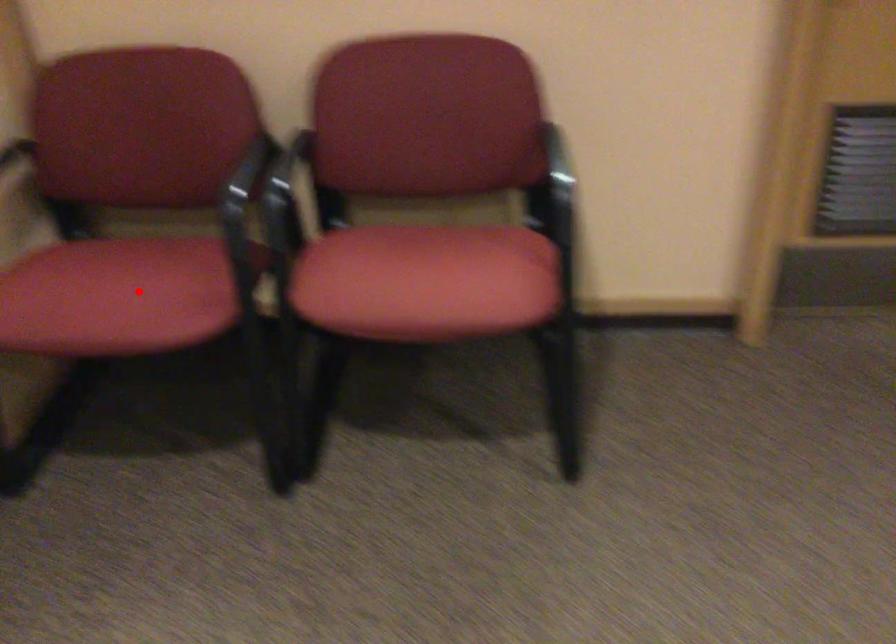
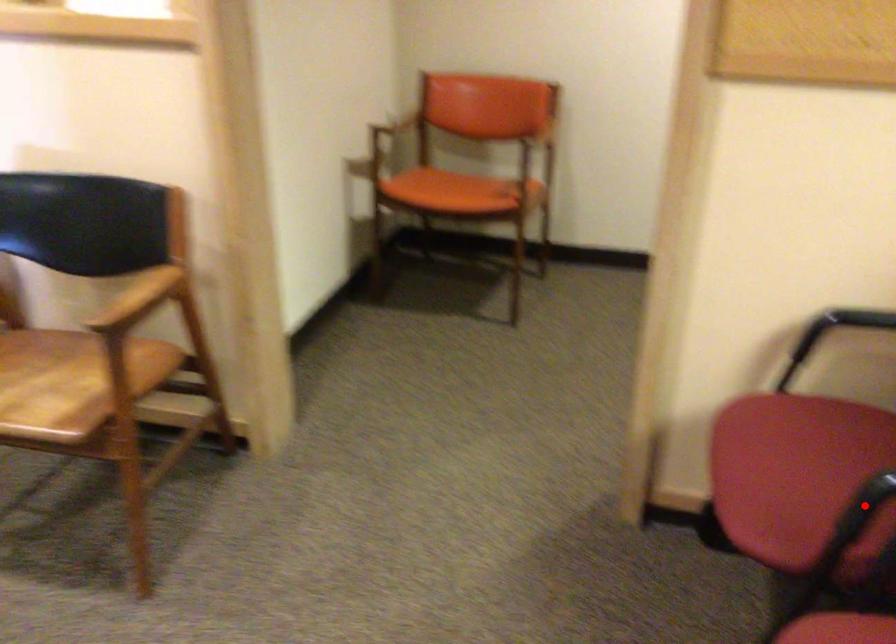
I am providing you with two images of the same scene from different viewpoints. A red point is marked on the first image and another point is marked on the second image. Is the marked point in image1 the same physical position as the marked point in image2?

No